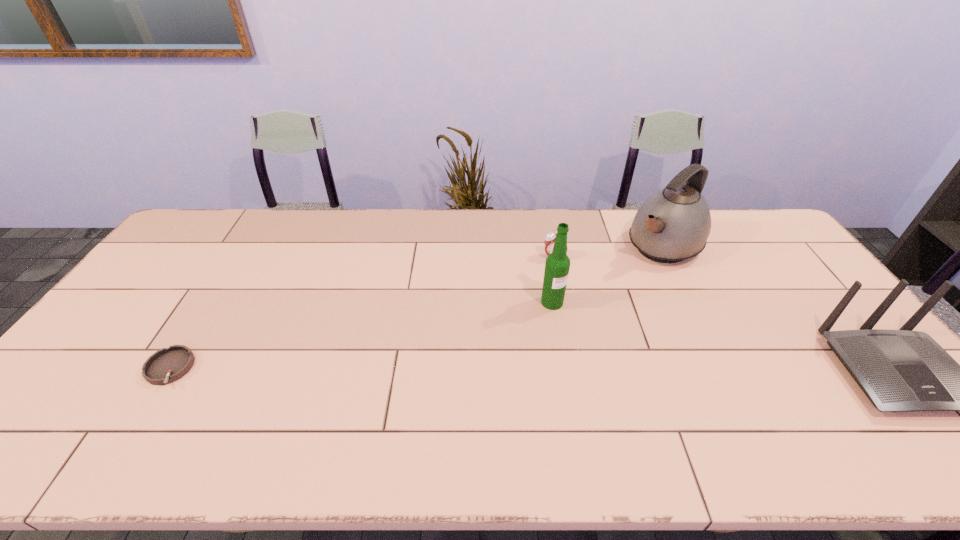
Where is `vacant space that satisfies the following two spatial constraints: 1. on the back side of the alarm clock; 2. on the right side of the ashtray`? vacant space that satisfies the following two spatial constraints: 1. on the back side of the alarm clock; 2. on the right side of the ashtray is located at coordinates (240, 257).